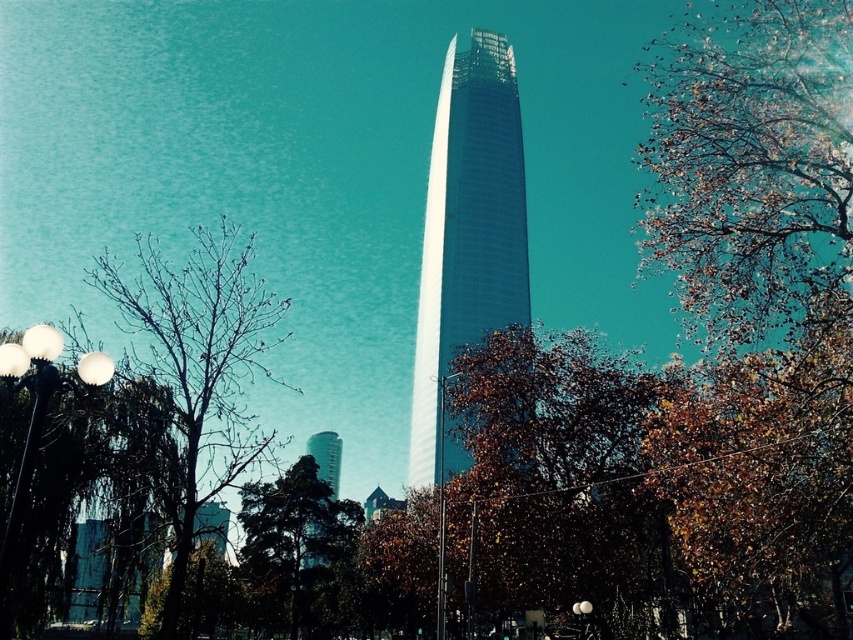
Which is in front, point (421, 317) or point (35, 438)?

Point (35, 438) is more forward.

Does glassy steel tower at center have a greater width compared to white glossy lamp post at left?

Indeed, glassy steel tower at center has a greater width compared to white glossy lamp post at left.

Between point (437, 179) and point (13, 502), which one is positioned in front?

Point (13, 502) is in front.

Identify the location of glassy steel tower at center. (467, 234).

Who is shorter, glassy steel tower at center or white glossy lamp post at center?

white glossy lamp post at center

Can you confirm if glassy steel tower at center is smaller than white glossy lamp post at center?

Incorrect, glassy steel tower at center is not smaller in size than white glossy lamp post at center.

Is point (456, 326) behind point (437, 582)?

Yes, point (456, 326) is behind point (437, 582).

The height and width of the screenshot is (640, 853). I want to click on glassy steel tower at center, so click(x=467, y=234).

Between point (260, 484) and point (310, 566), which one is positioned in front?

Positioned in front is point (260, 484).

Is green leafy tree at center taller than smooth glass tower at center?

Correct, green leafy tree at center is much taller as smooth glass tower at center.

This screenshot has height=640, width=853. In order to click on green leafy tree at center in this screenshot , I will do `click(292, 536)`.